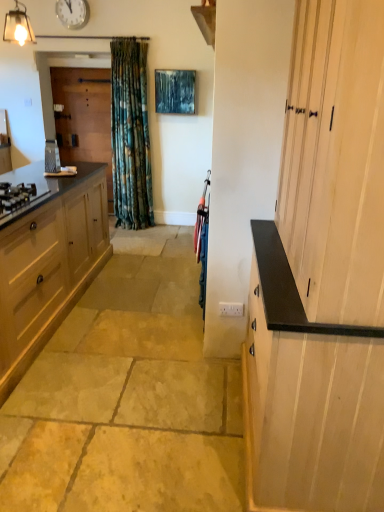
Question: From the image's perspective, is matte wood cabinet at left, arranged as the 2th cabinetry when viewed from the right, over natural stone floor at center?

Choices:
 (A) no
 (B) yes

Answer: (B)

Question: Can you confirm if matte wood cabinet at left, arranged as the 2th cabinetry when viewed from the right, is thinner than natural stone floor at center?

Choices:
 (A) no
 (B) yes

Answer: (B)

Question: Is matte wood cabinet at left, arranged as the 2th cabinetry when viewed from the right, oriented towards natural stone floor at center?

Choices:
 (A) yes
 (B) no

Answer: (A)

Question: Is matte wood cabinet at left, the 1th cabinetry in the left-to-right sequence, to the right of natural stone floor at center from the viewer's perspective?

Choices:
 (A) yes
 (B) no

Answer: (B)

Question: Considering the relative sizes of matte wood cabinet at left, arranged as the 2th cabinetry when viewed from the right, and natural stone floor at center in the image provided, is matte wood cabinet at left, arranged as the 2th cabinetry when viewed from the right, smaller than natural stone floor at center?

Choices:
 (A) no
 (B) yes

Answer: (A)

Question: From the image's perspective, is matte black gas stove at left positioned above or below matte wood cabinet at left, the 1th cabinetry in the left-to-right sequence?

Choices:
 (A) above
 (B) below

Answer: (A)

Question: Is point (1, 193) closer or farther from the camera than point (54, 311)?

Choices:
 (A) closer
 (B) farther

Answer: (A)

Question: Would you say matte black gas stove at left is to the left or to the right of matte wood cabinet at left, the 1th cabinetry in the left-to-right sequence, in the picture?

Choices:
 (A) right
 (B) left

Answer: (A)

Question: Considering the positions of matte black gas stove at left and matte wood cabinet at left, arranged as the 2th cabinetry when viewed from the right, in the image, is matte black gas stove at left wider or thinner than matte wood cabinet at left, arranged as the 2th cabinetry when viewed from the right,?

Choices:
 (A) thin
 (B) wide

Answer: (A)

Question: Is matte wood cabinet at left, arranged as the 2th cabinetry when viewed from the right, spatially inside light wood cabinet at right, the 1th cabinetry from the right, or outside of it?

Choices:
 (A) outside
 (B) inside

Answer: (A)

Question: Does point (79, 284) appear closer or farther from the camera than point (367, 135)?

Choices:
 (A) closer
 (B) farther

Answer: (B)

Question: Would you say matte wood cabinet at left, the 1th cabinetry in the left-to-right sequence, is to the left or to the right of light wood cabinet at right, which is counted as the 2th cabinetry, starting from the left, in the picture?

Choices:
 (A) left
 (B) right

Answer: (A)

Question: In the image, is matte wood cabinet at left, the 1th cabinetry in the left-to-right sequence, positioned in front of or behind light wood cabinet at right, the 1th cabinetry from the right?

Choices:
 (A) front
 (B) behind

Answer: (B)

Question: Is matte black gas stove at left bigger or smaller than matte glass light fixture at upper left?

Choices:
 (A) big
 (B) small

Answer: (A)

Question: In the image, is matte black gas stove at left positioned in front of or behind matte glass light fixture at upper left?

Choices:
 (A) behind
 (B) front

Answer: (B)